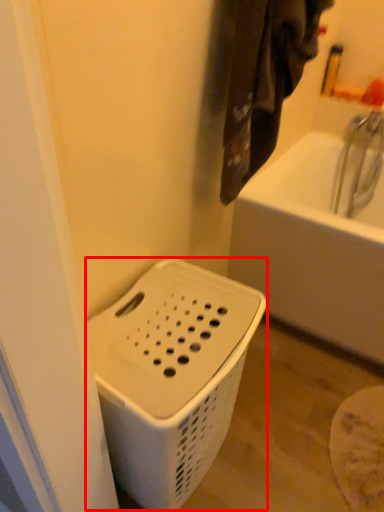
Question: Observing the image, what is the correct spatial positioning of basket container (annotated by the red box) in reference to laundry?

Choices:
 (A) left
 (B) right

Answer: (A)